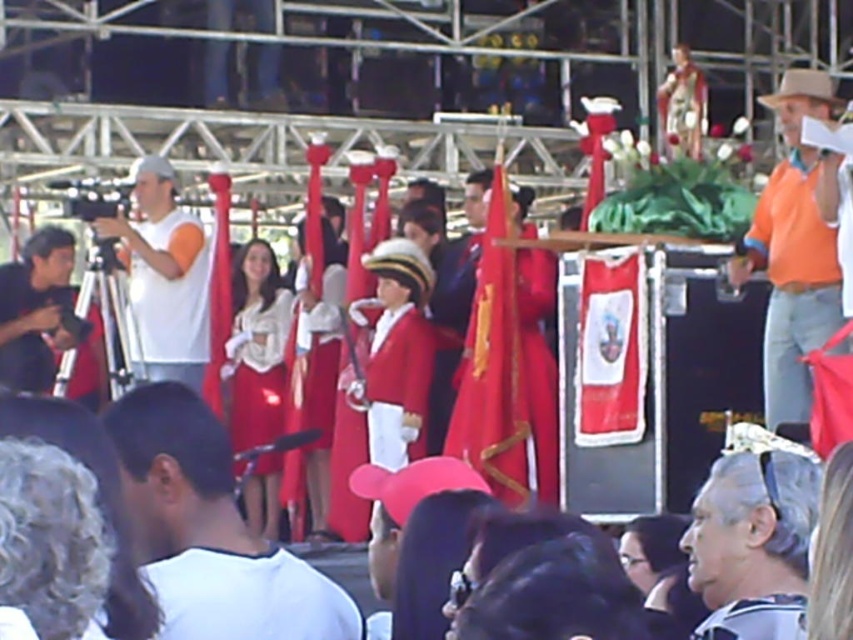
Question: Considering the relative positions of orange cotton shirt at right and shiny red fabric at center in the image provided, where is orange cotton shirt at right located with respect to shiny red fabric at center?

Choices:
 (A) left
 (B) right

Answer: (B)

Question: Which of the following is the closest to the observer?

Choices:
 (A) (309, 275)
 (B) (355, 509)
 (C) (822, 504)

Answer: (C)

Question: Which object is farther from the camera taking this photo?

Choices:
 (A) matte white blouse at center
 (B) shiny blue suit at center
 (C) white matte shirt at center
 (D) smooth black hair at center

Answer: (A)

Question: Which point appears farthest from the camera in this image?

Choices:
 (A) (782, 275)
 (B) (798, 582)
 (C) (300, 349)
 (D) (465, 323)

Answer: (C)

Question: From the image, what is the correct spatial relationship of orange cotton shirt at right in relation to white matte camera at left?

Choices:
 (A) below
 (B) above

Answer: (B)

Question: Can you confirm if orange cotton shirt at right is positioned below matte white blouse at center?

Choices:
 (A) yes
 (B) no

Answer: (B)